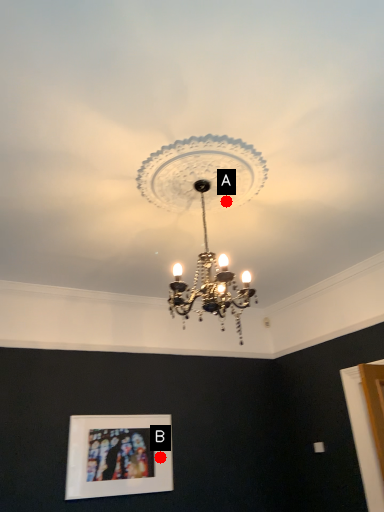
Question: Two points are circled on the image, labeled by A and B beside each circle. Which of the following is the farthest from the observer?

Choices:
 (A) A is further
 (B) B is further

Answer: (B)